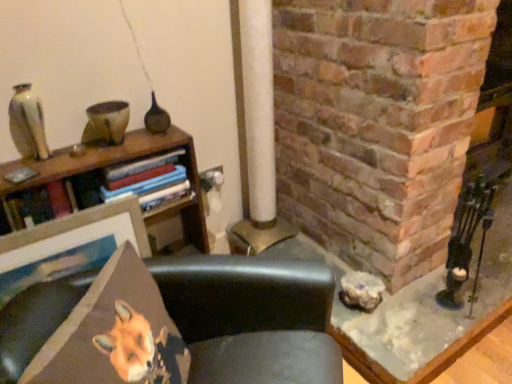
Locate an element on the screen. vacant space to the right of matte white vase at upper left is located at coordinates click(75, 160).